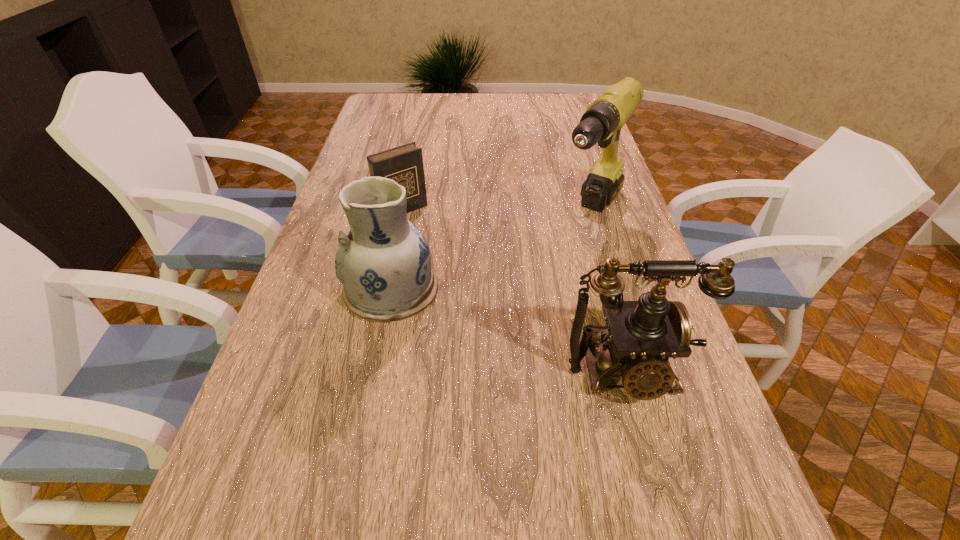
Identify the location of vacant space on the desktop that is between the second nearest object and the nearest object and is positioned on the handle side of the drill. The width and height of the screenshot is (960, 540). (502, 328).

Find the location of `vacant spot on the desktop that is between the pottery and the telephone and is positioned on the front cover of the diary`. vacant spot on the desktop that is between the pottery and the telephone and is positioned on the front cover of the diary is located at coordinates (516, 333).